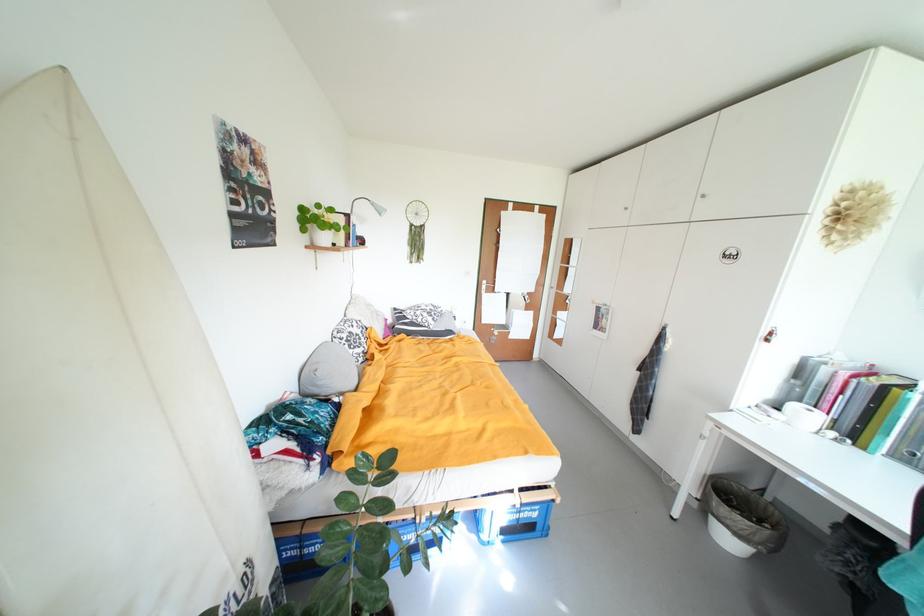
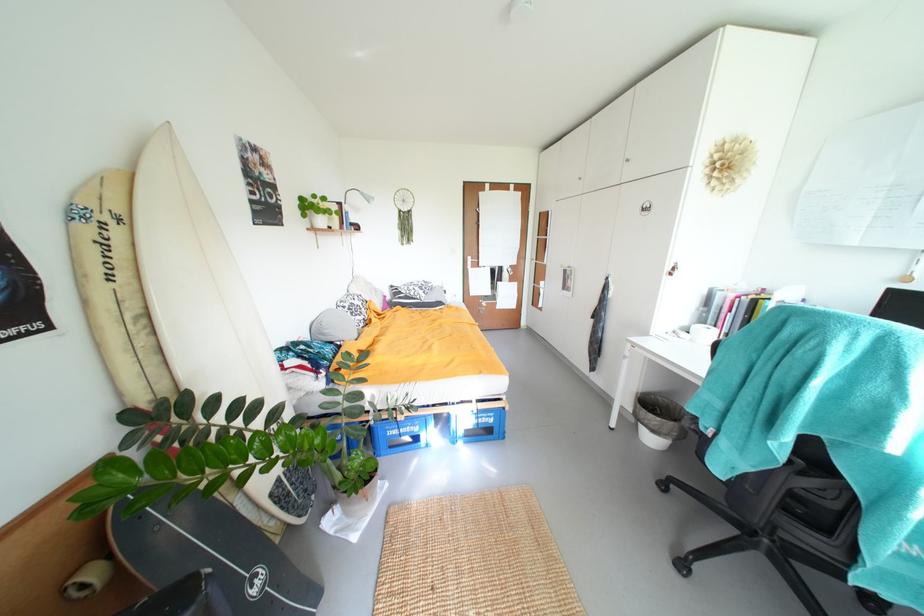
In the second image, find the point that corresponds to point 736,544 in the first image.

(659, 442)